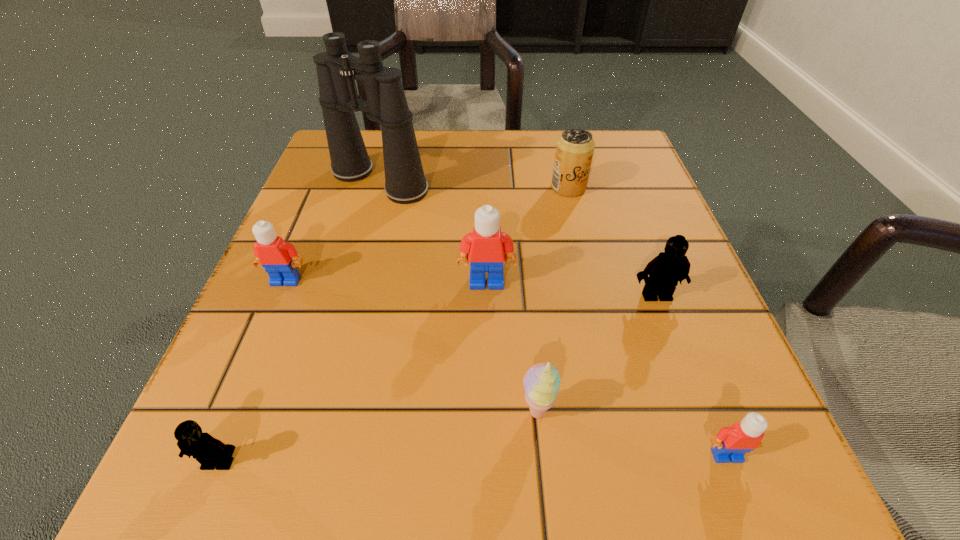
The image size is (960, 540). I want to click on binoculars positioned at the left edge, so click(x=405, y=183).

Where is `beer can present at the right edge`? beer can present at the right edge is located at coordinates (574, 150).

This screenshot has width=960, height=540. What are the coordinates of `object that is at the far left corner` in the screenshot? It's located at (405, 183).

Locate an element on the screen. The width and height of the screenshot is (960, 540). object at the near left corner is located at coordinates (208, 451).

Locate an element on the screen. The image size is (960, 540). object that is at the far right corner is located at coordinates (574, 150).

Where is `object positioned at the near right corner`? object positioned at the near right corner is located at coordinates (731, 443).

Identify the location of vacant space at the far edge. (547, 179).

You are a GUI agent. You are given a task and a screenshot of the screen. Output one action in this format:
    pyautogui.click(x=<x>, y=<y>)
    Task: Click on the vacant region at the near edge of the desktop
    
    Given the screenshot: What is the action you would take?
    pyautogui.click(x=565, y=488)

This screenshot has width=960, height=540. Identify the location of vacant space at the left edge of the desktop. (283, 320).

You are a GUI agent. You are given a task and a screenshot of the screen. Output one action in this format:
    pyautogui.click(x=<x>, y=<y>)
    Task: Click on the free location at the right edge of the desktop
    
    Given the screenshot: What is the action you would take?
    pyautogui.click(x=688, y=386)